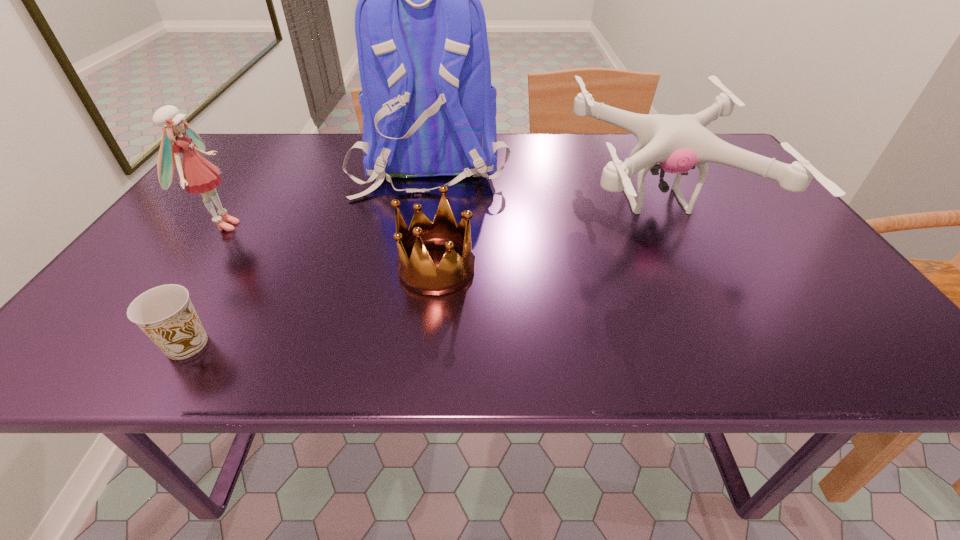
Where is `backpack`? The height and width of the screenshot is (540, 960). backpack is located at coordinates (428, 107).

Find the location of a particular element. The image size is (960, 540). doll is located at coordinates (197, 175).

In order to click on the third tallest object in this screenshot , I will do `click(677, 142)`.

Locate an element on the screen. This screenshot has height=540, width=960. the rightmost object is located at coordinates (677, 142).

You are a GUI agent. You are given a task and a screenshot of the screen. Output one action in this format:
    pyautogui.click(x=<x>, y=<y>)
    Task: Click on the fourth tallest object
    
    Given the screenshot: What is the action you would take?
    pyautogui.click(x=419, y=274)

Identify the location of the nearest object. This screenshot has width=960, height=540. (165, 314).

The width and height of the screenshot is (960, 540). In order to click on the shortest object in this screenshot , I will do `click(165, 314)`.

This screenshot has height=540, width=960. In order to click on free space located 0.210m on the back of the backpack in this screenshot , I will do `click(415, 256)`.

Identify the location of free space located on the front-facing side of the doll. (271, 226).

Find the location of a particular element. This screenshot has width=960, height=540. blank space located on the top of the third shortest object is located at coordinates (417, 201).